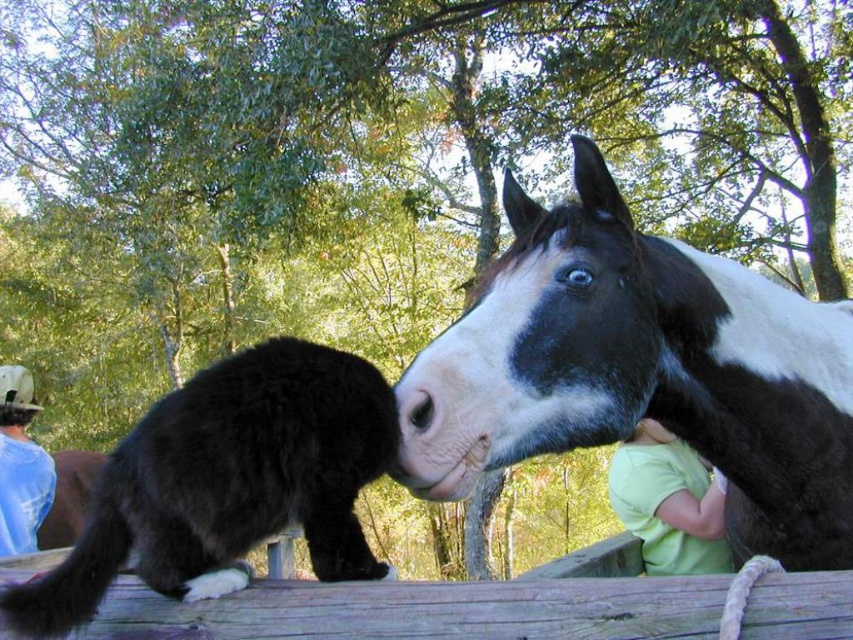
You are a photographer trying to capture the perfect shot of the black and white speckled horse at right and the light green fabric at lower right. Based on their positions, which object is closer to the left edge of the photo?

The black and white speckled horse at right is positioned on the left side of light green fabric at lower right, so the horse is closer to the left edge of the photo.

You are a photographer trying to capture the interaction between the black cat and the horse in the image. You notice a point at coordinates (641, 371). What animal is located at that point?

The point at coordinates (641, 371) indicates the black and white speckled horse at right.